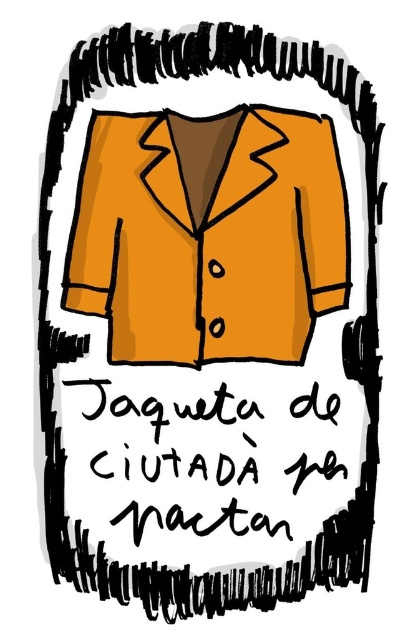
Who is more distant from viewer, (242, 232) or (219, 477)?

Positioned behind is point (219, 477).

Does orange matte jacket at center appear under black handwritten text at center?

Actually, orange matte jacket at center is above black handwritten text at center.

Between point (237, 275) and point (173, 483), which one is positioned in front?

Positioned in front is point (237, 275).

Image resolution: width=418 pixels, height=640 pixels. In order to click on orange matte jacket at center in this screenshot , I will do `click(209, 234)`.